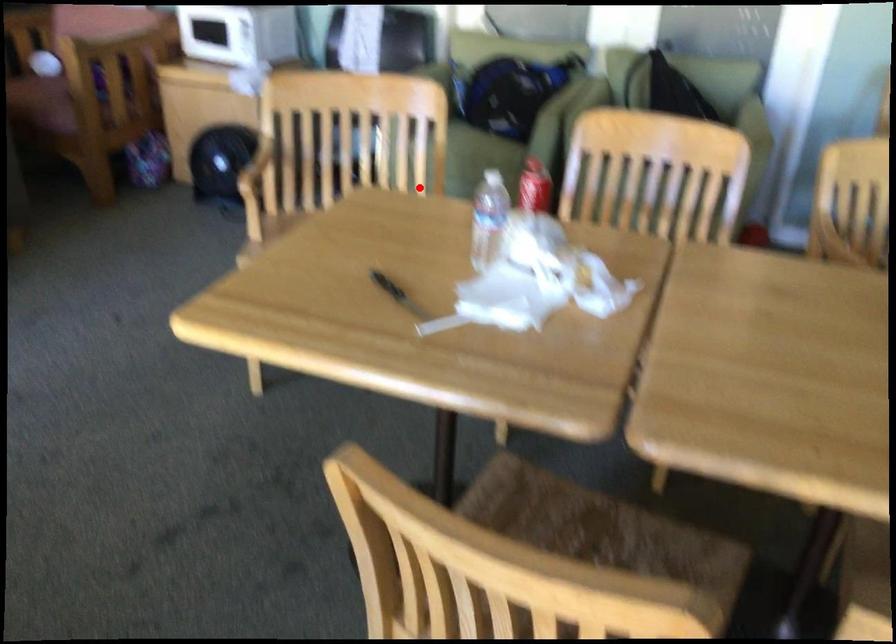
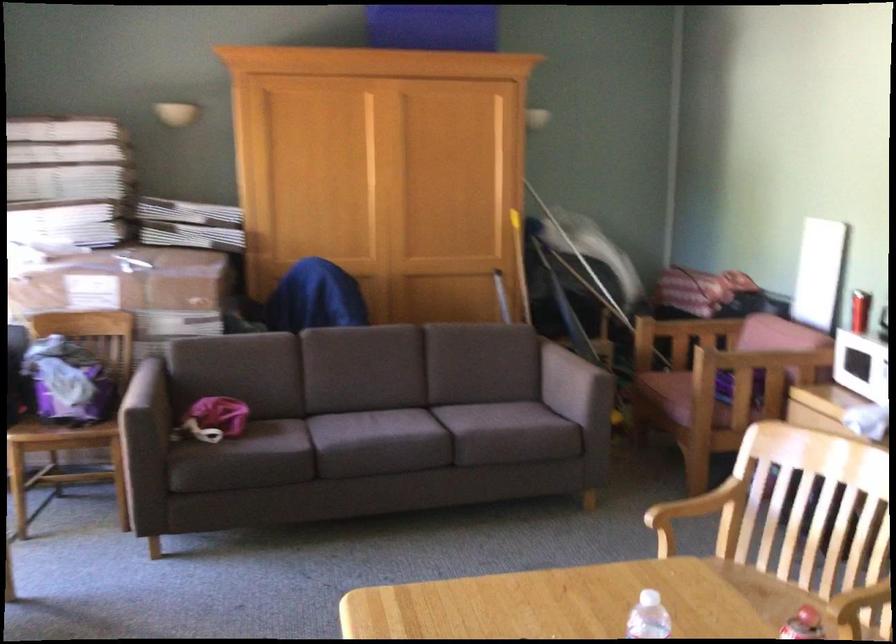
Question: I am providing you with two images of the same scene from different viewpoints. Given a red point in image1, look at the same physical point in image2. Is it:

Choices:
 (A) Closer to the viewpoint
 (B) Farther from the viewpoint

Answer: (A)